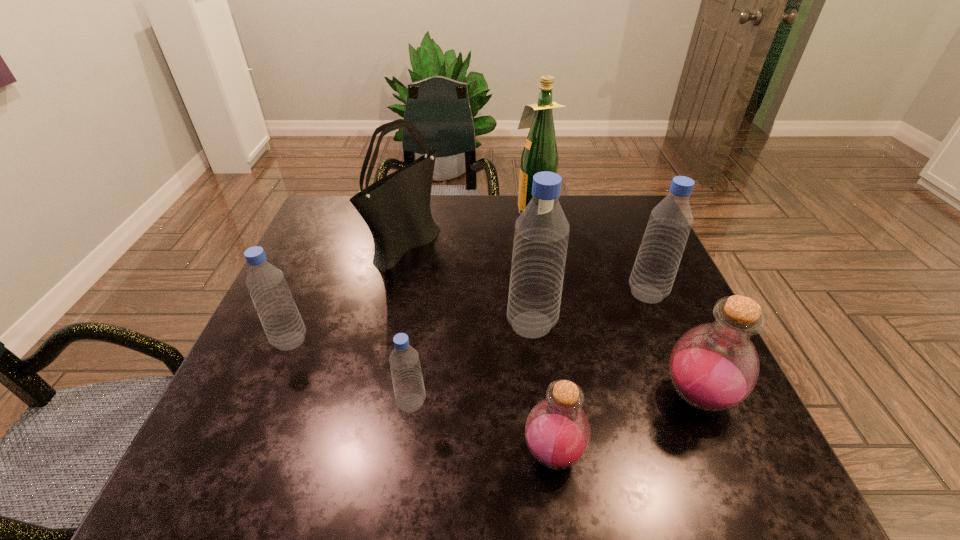
Find the location of `the nearest blue bottle`. the nearest blue bottle is located at coordinates (409, 391).

At what (x,y) coordinates should I click in order to perform the action: click on the left purple bottle. Please return your answer as a coordinate pair (x, y). This screenshot has height=540, width=960. Looking at the image, I should click on (557, 431).

Locate an element on the screen. free space located 0.190m on the front-facing side of the liquor is located at coordinates (450, 211).

The height and width of the screenshot is (540, 960). I want to click on vacant position located on the front-facing side of the liquor, so click(x=410, y=211).

Identify the location of vacant space situated 0.150m on the front-facing side of the liquor. This screenshot has height=540, width=960. (464, 211).

The width and height of the screenshot is (960, 540). I want to click on vacant region located 0.210m on the front of the third blue bottle from left to right, so click(545, 435).

This screenshot has width=960, height=540. In order to click on vacant space positioned 0.150m on the front of the shoulder bag in this screenshot , I will do `click(391, 316)`.

Identify the location of vacant region located 0.350m on the front of the farthest blue bottle. (712, 452).

Where is `vacant space located on the front of the leftmost blue bottle`? vacant space located on the front of the leftmost blue bottle is located at coordinates (261, 409).

Locate an element on the screen. This screenshot has width=960, height=540. vacant space located on the back of the right purple bottle is located at coordinates (637, 258).